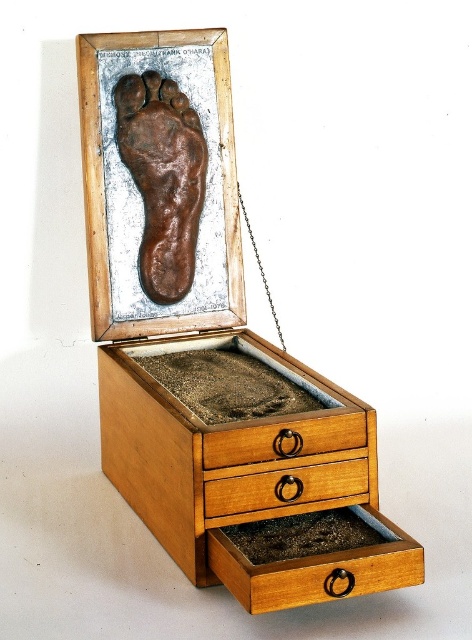
From the picture: Which is below, wooden drawer at center or light brown wood drawer at center?

light brown wood drawer at center

At what (x,y) coordinates should I click in order to perform the action: click on wooden drawer at center. Please return your answer as a coordinate pair (x, y). Image resolution: width=472 pixels, height=640 pixels. Looking at the image, I should click on (211, 349).

Where is `wooden drawer at center`? Image resolution: width=472 pixels, height=640 pixels. wooden drawer at center is located at coordinates (211, 349).

What are the coordinates of `brown clay foot at center` in the screenshot? It's located at (162, 177).

Measure the distance from brown clay foot at center to light brown wood drawer at center.

brown clay foot at center and light brown wood drawer at center are 55.89 centimeters apart.

Between point (202, 164) and point (345, 493), which one is positioned in front?

Point (345, 493) is in front.

Where is `brown clay foot at center`? The image size is (472, 640). brown clay foot at center is located at coordinates (162, 177).

Does wooden drawer at center lie in front of brown clay foot at center?

Yes, it is in front of brown clay foot at center.

Describe the element at coordinates (211, 349) in the screenshot. The height and width of the screenshot is (640, 472). I see `wooden drawer at center` at that location.

Where is `wooden drawer at center`? wooden drawer at center is located at coordinates (211, 349).